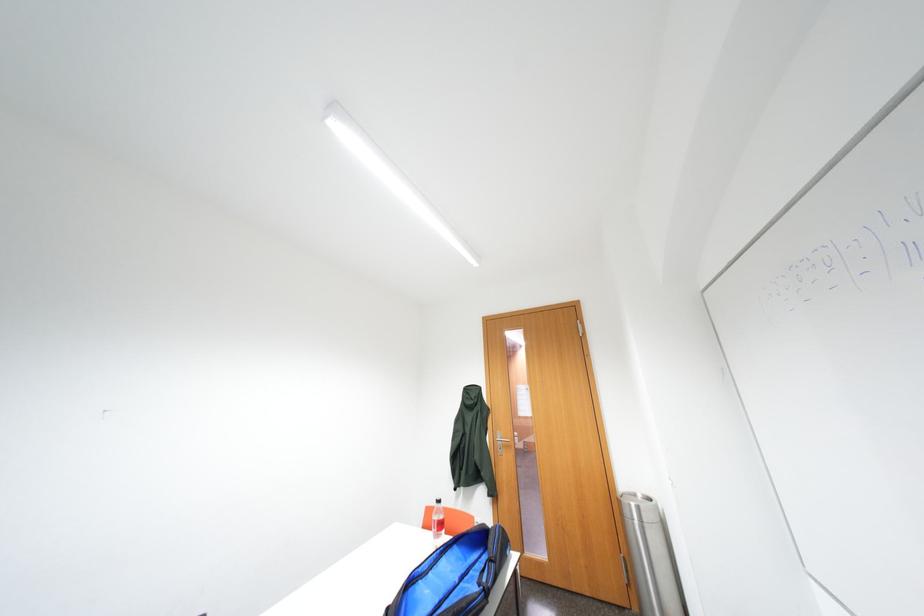
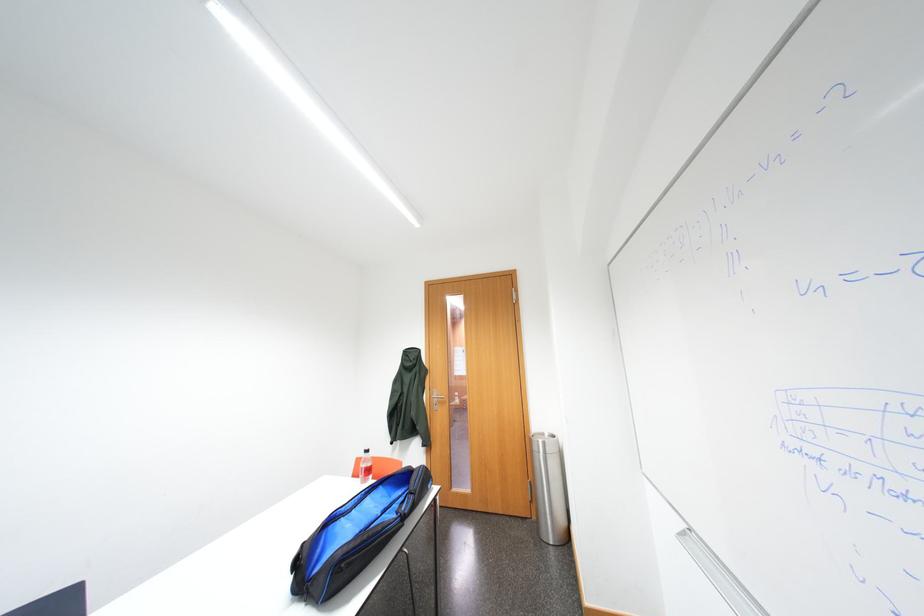
Question: The images are taken continuously from a first-person perspective. In which direction are you moving?

Choices:
 (A) Left
 (B) Right
 (C) Forward
 (D) Backward

Answer: (B)